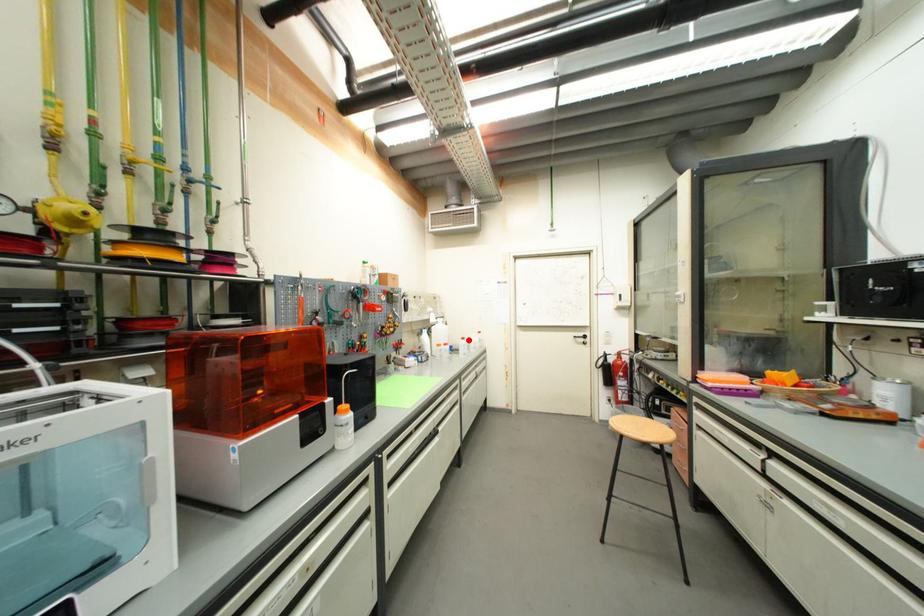
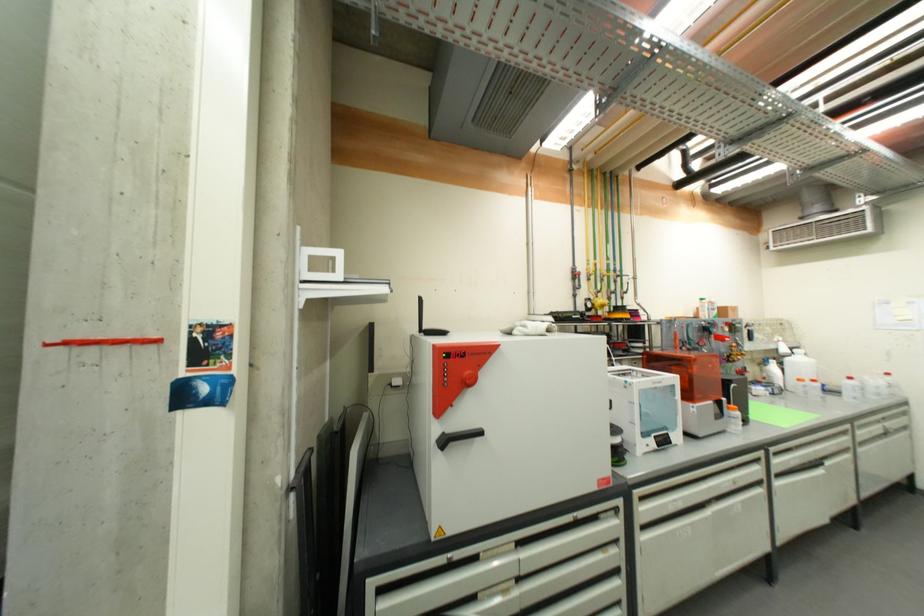
Question: A red point is marked in image1. In image2, is the corresponding 3D point closer to the camera or farther? Reply with the corresponding letter.

Choices:
 (A) The corresponding 3D point is closer.
 (B) The corresponding 3D point is farther.

Answer: (A)